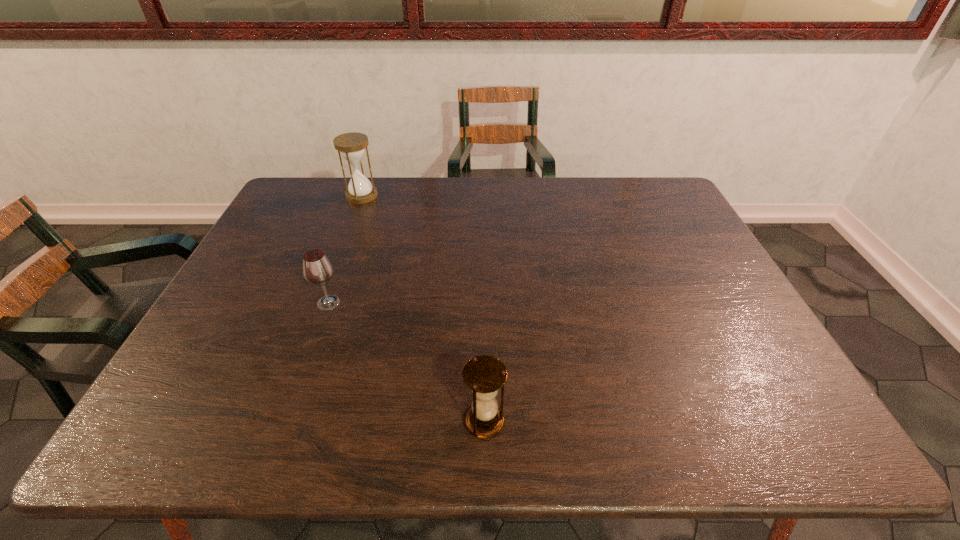
You are a GUI agent. You are given a task and a screenshot of the screen. Output one action in this format:
    pyautogui.click(x=<x>, y=<y>)
    Task: Click on the taller hourglass
    The height and width of the screenshot is (540, 960).
    Given the screenshot: What is the action you would take?
    pyautogui.click(x=352, y=145)

You are a GUI agent. You are given a task and a screenshot of the screen. Output one action in this format:
    pyautogui.click(x=<x>, y=<y>)
    Task: Click on the tallest object
    This screenshot has width=960, height=540.
    Given the screenshot: What is the action you would take?
    pyautogui.click(x=352, y=145)

Where is `the nearest object`? Image resolution: width=960 pixels, height=540 pixels. the nearest object is located at coordinates (484, 375).

At what (x,y) coordinates should I click in order to perform the action: click on the shorter hourglass. Please return your answer as a coordinate pair (x, y). Looking at the image, I should click on (484, 375).

Locate an element on the screen. wineglass is located at coordinates (317, 268).

This screenshot has width=960, height=540. I want to click on vacant space positioned on the right of the left hourglass, so click(426, 195).

This screenshot has width=960, height=540. I want to click on vacant area situated 0.320m on the left of the right hourglass, so click(307, 421).

The width and height of the screenshot is (960, 540). Identify the location of vacant space located on the front of the wineglass. [302, 375].

In order to click on object positioned at the far edge in this screenshot , I will do `click(352, 145)`.

Locate an element on the screen. Image resolution: width=960 pixels, height=540 pixels. object that is at the near edge is located at coordinates click(484, 375).